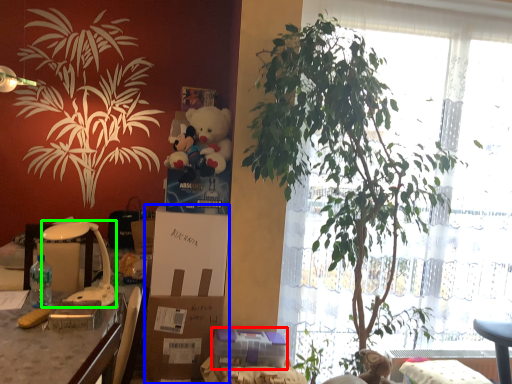
Question: Considering the real-world distances, which object is closest to gift (highlighted by a red box)? box (highlighted by a blue box) or lamp (highlighted by a green box).

Choices:
 (A) box
 (B) lamp

Answer: (A)